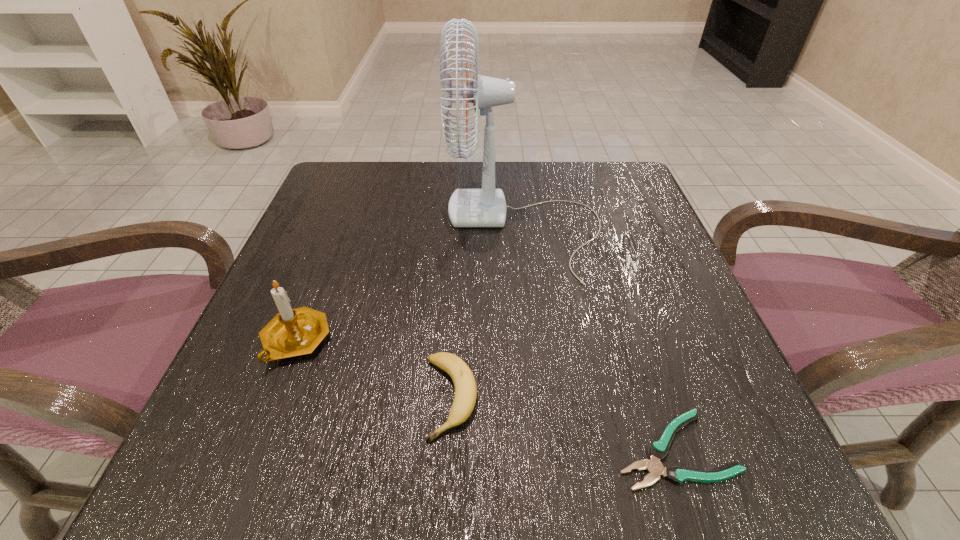
In order to click on free spot that satisfies the following two spatial constraints: 1. on the front side of the banana; 2. on the right side of the candle holder in this screenshot , I will do `click(274, 397)`.